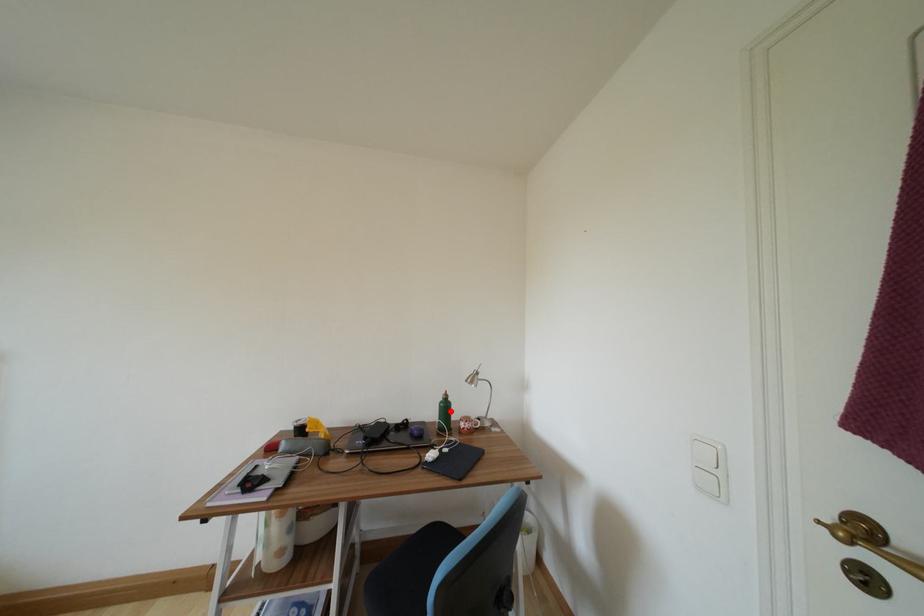
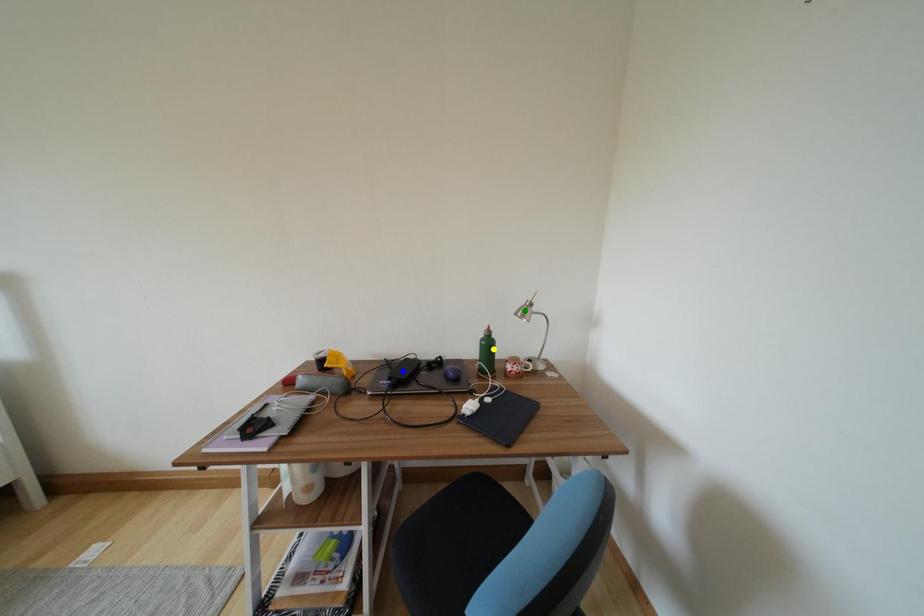
Question: I am providing you with two images of the same scene from different viewpoints. A red point is marked on the first image. You are given multiple points on the second image. Which point in image 2 is actually the same real-world point as the red point in image 1?

Choices:
 (A) green point
 (B) yellow point
 (C) blue point

Answer: (B)